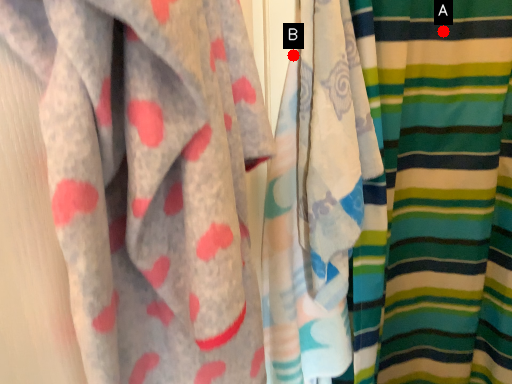
Question: Two points are circled on the image, labeled by A and B beside each circle. Which point is closer to the camera?

Choices:
 (A) A is closer
 (B) B is closer

Answer: (B)